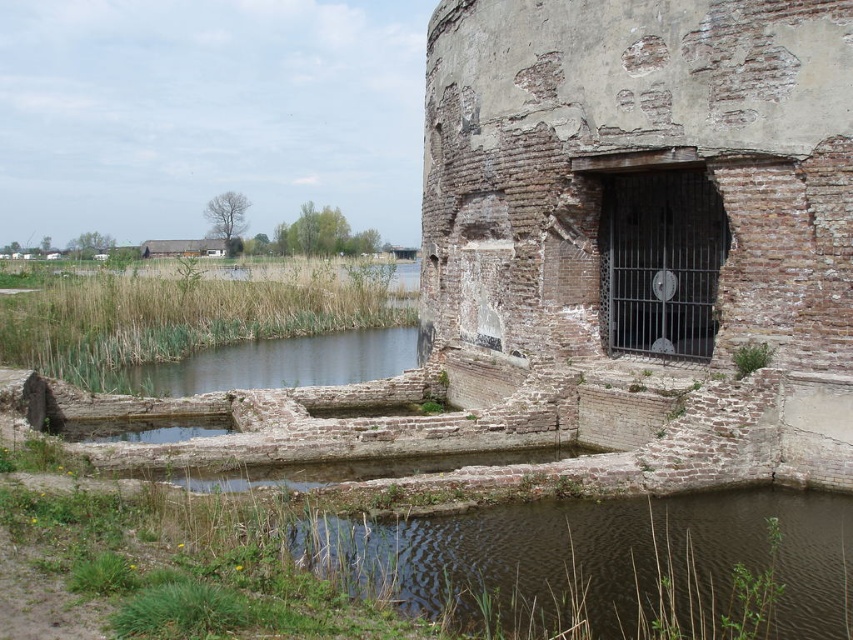
Question: Which object appears closest to the camera in this image?

Choices:
 (A) weathered brick wall at center right
 (B) brown/rough stone pond at lower center

Answer: (B)

Question: Can you confirm if weathered brick wall at center right is positioned to the right of brown/rough stone pond at lower center?

Choices:
 (A) no
 (B) yes

Answer: (A)

Question: Observing the image, what is the correct spatial positioning of weathered brick wall at center right in reference to brown/rough stone pond at lower center?

Choices:
 (A) above
 (B) below

Answer: (A)

Question: Can you confirm if weathered brick wall at center right is wider than brown/rough stone pond at lower center?

Choices:
 (A) no
 (B) yes

Answer: (A)

Question: Which object appears closest to the camera in this image?

Choices:
 (A) brown/rough stone pond at lower center
 (B) weathered brick wall at center right

Answer: (A)